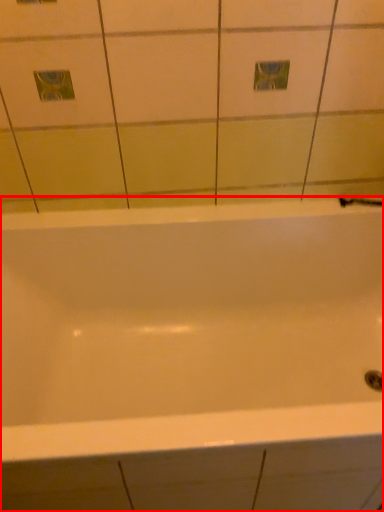
Question: From the image's perspective, where is bathtub (annotated by the red box) located in relation to shower in the image?

Choices:
 (A) above
 (B) below

Answer: (B)